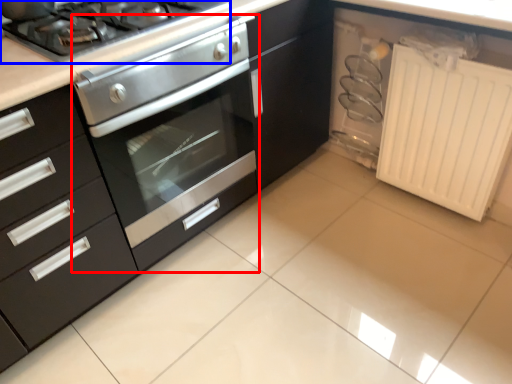
Question: Among these objects, which one is nearest to the camera, oven (highlighted by a red box) or gas stove (highlighted by a blue box)?

Choices:
 (A) oven
 (B) gas stove

Answer: (A)